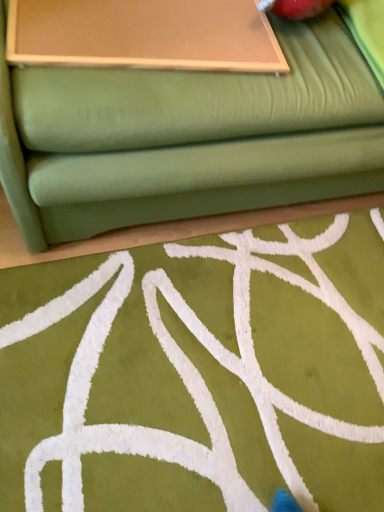
Measure the distance between point (15,27) and camera.

Point (15,27) and camera are 34.25 inches apart from each other.

What do you see at coordinates (144, 34) in the screenshot?
I see `matte brown board at upper center` at bounding box center [144, 34].

Identify the location of matte brown board at upper center. (144, 34).

The image size is (384, 512). Describe the element at coordinates (187, 137) in the screenshot. I see `green fabric studio couch at upper center` at that location.

What is the approximate width of green fabric studio couch at upper center?

The width of green fabric studio couch at upper center is 92.00 centimeters.

I want to click on green fabric studio couch at upper center, so click(187, 137).

Image resolution: width=384 pixels, height=512 pixels. In order to click on matte brown board at upper center in this screenshot , I will do `click(144, 34)`.

In the image, is green fabric studio couch at upper center on the left side or the right side of matte brown board at upper center?

Based on their positions, green fabric studio couch at upper center is located to the right of matte brown board at upper center.

Which object is closer to the camera taking this photo, green fabric studio couch at upper center or matte brown board at upper center?

green fabric studio couch at upper center is in front.

Which is in front, point (11, 109) or point (23, 29)?

The point (11, 109) is more forward.

From the image's perspective, is green fabric studio couch at upper center positioned above or below matte brown board at upper center?

Clearly, from the image's perspective, green fabric studio couch at upper center is above matte brown board at upper center.

From a real-world perspective, which object stands above the other?

matte brown board at upper center.

Which object is wider, green fabric studio couch at upper center or matte brown board at upper center?

green fabric studio couch at upper center is wider.

Is green fabric studio couch at upper center shorter than matte brown board at upper center?

In fact, green fabric studio couch at upper center may be taller than matte brown board at upper center.

Considering the sizes of objects green fabric studio couch at upper center and matte brown board at upper center in the image provided, who is bigger, green fabric studio couch at upper center or matte brown board at upper center?

Bigger between the two is green fabric studio couch at upper center.

Is green fabric studio couch at upper center inside the boundaries of matte brown board at upper center, or outside?

green fabric studio couch at upper center is not enclosed by matte brown board at upper center.

Are green fabric studio couch at upper center and matte brown board at upper center making contact?

No.

Is matte brown board at upper center at the back of green fabric studio couch at upper center?

Yes, matte brown board at upper center is at the back of green fabric studio couch at upper center.

Where is `table below the green fabric studio couch at upper center (from the image's perspective)`? table below the green fabric studio couch at upper center (from the image's perspective) is located at coordinates (144, 34).

Is matte brown board at upper center to the right of green fabric studio couch at upper center from the viewer's perspective?

No, matte brown board at upper center is not to the right of green fabric studio couch at upper center.

In the image, is matte brown board at upper center positioned in front of or behind green fabric studio couch at upper center?

matte brown board at upper center is behind green fabric studio couch at upper center.

Between point (140, 5) and point (19, 89), which one is positioned behind?

Point (140, 5)

From the image's perspective, who appears lower, matte brown board at upper center or green fabric studio couch at upper center?

From the image's view, matte brown board at upper center is below.

Consider the image. From a real-world perspective, between matte brown board at upper center and green fabric studio couch at upper center, who is vertically lower?

From a 3D spatial view, green fabric studio couch at upper center is below.

Consider the image. Considering the sizes of objects matte brown board at upper center and green fabric studio couch at upper center in the image provided, who is thinner, matte brown board at upper center or green fabric studio couch at upper center?

matte brown board at upper center is thinner.

In terms of height, does matte brown board at upper center look taller or shorter compared to green fabric studio couch at upper center?

Considering their sizes, matte brown board at upper center has less height than green fabric studio couch at upper center.

Who is bigger, matte brown board at upper center or green fabric studio couch at upper center?

green fabric studio couch at upper center.

Does matte brown board at upper center contain green fabric studio couch at upper center?

No, green fabric studio couch at upper center is not surrounded by matte brown board at upper center.

Is matte brown board at upper center with green fabric studio couch at upper center?

No, matte brown board at upper center is not in contact with green fabric studio couch at upper center.

Is matte brown board at upper center facing away from green fabric studio couch at upper center?

Yes, green fabric studio couch at upper center is at the back of matte brown board at upper center.

In order to click on studio couch located in front of the matte brown board at upper center in this screenshot , I will do `click(187, 137)`.

Image resolution: width=384 pixels, height=512 pixels. I want to click on studio couch beneath the matte brown board at upper center (from a real-world perspective), so click(x=187, y=137).

This screenshot has height=512, width=384. Find the location of `studio couch that appears in front of the matte brown board at upper center`. studio couch that appears in front of the matte brown board at upper center is located at coordinates (187, 137).